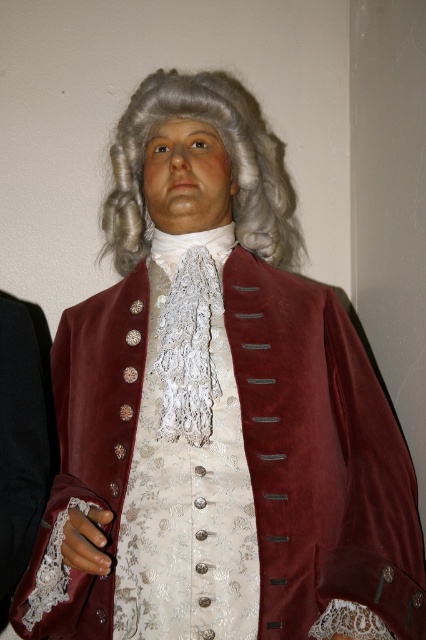
Question: Does white lace dress at center appear on the left side of grayhair at center?

Choices:
 (A) yes
 (B) no

Answer: (A)

Question: Which object appears closest to the camera in this image?

Choices:
 (A) grayhair at center
 (B) white lace dress at center

Answer: (B)

Question: Is white lace dress at center positioned before grayhair at center?

Choices:
 (A) yes
 (B) no

Answer: (A)

Question: Can you confirm if white lace dress at center is thinner than grayhair at center?

Choices:
 (A) yes
 (B) no

Answer: (A)

Question: Among these points, which one is nearest to the camera?

Choices:
 (A) (276, 204)
 (B) (215, 579)

Answer: (B)